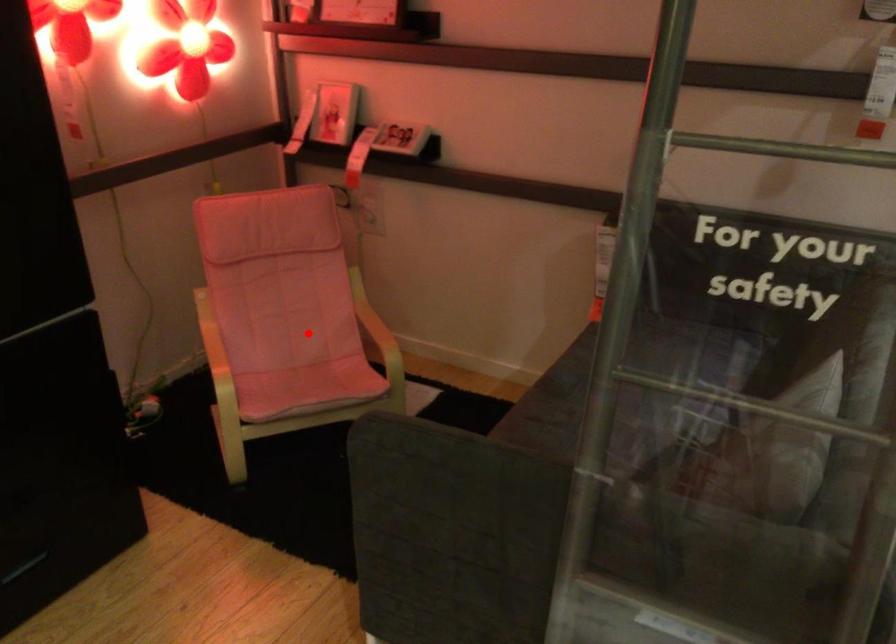
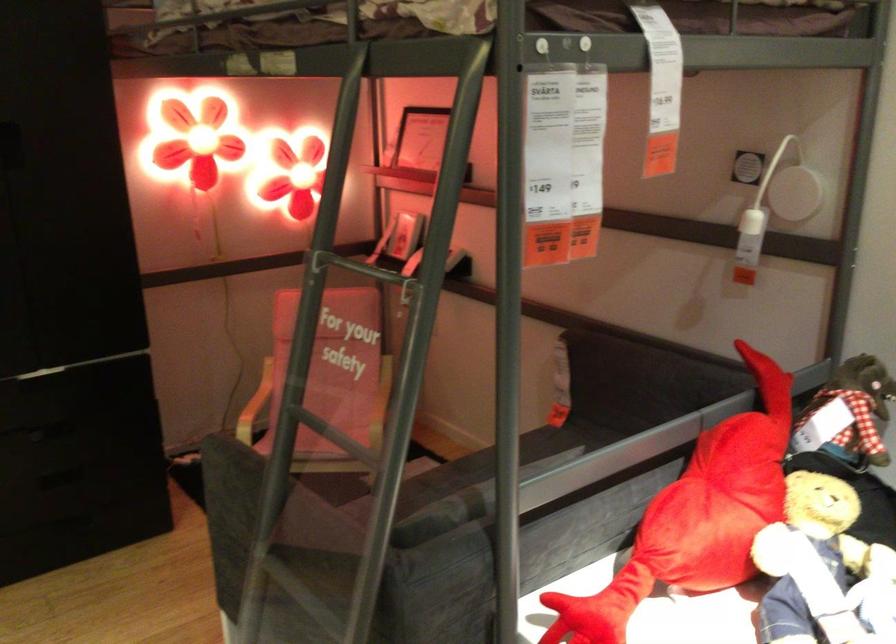
Where in the second image is the point corresponding to the highlighted location from the first image?

(331, 404)